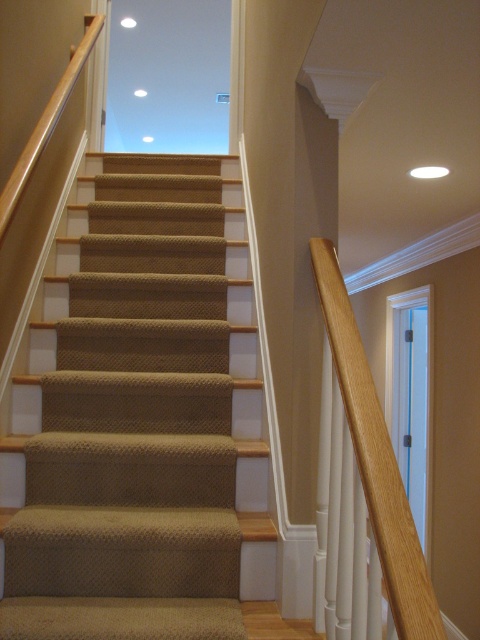
Question: Which of the following is the farthest from the observer?

Choices:
 (A) (214, 573)
 (B) (425, 604)

Answer: (A)

Question: Is the position of beige carpeted stairs at center more distant than that of wooden handrail at right?

Choices:
 (A) yes
 (B) no

Answer: (A)

Question: Among these points, which one is farthest from the camera?

Choices:
 (A) (36, 588)
 (B) (371, 406)

Answer: (A)

Question: Which of the following is the closest to the observer?

Choices:
 (A) beige carpeted stairs at center
 (B) wooden handrail at right

Answer: (B)

Question: Is beige carpeted stairs at center closer to the viewer compared to wooden handrail at right?

Choices:
 (A) yes
 (B) no

Answer: (B)

Question: Does beige carpeted stairs at center come in front of wooden handrail at right?

Choices:
 (A) yes
 (B) no

Answer: (B)